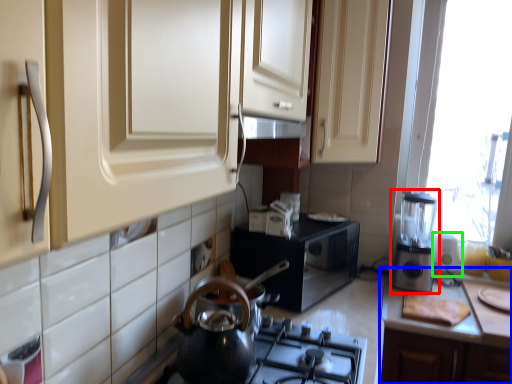
Question: Based on their relative distances, which object is nearer to kitchen appliance (highlighted by a red box)? Choose from countertop (highlighted by a blue box) and appliance (highlighted by a green box).

Choices:
 (A) countertop
 (B) appliance

Answer: (B)